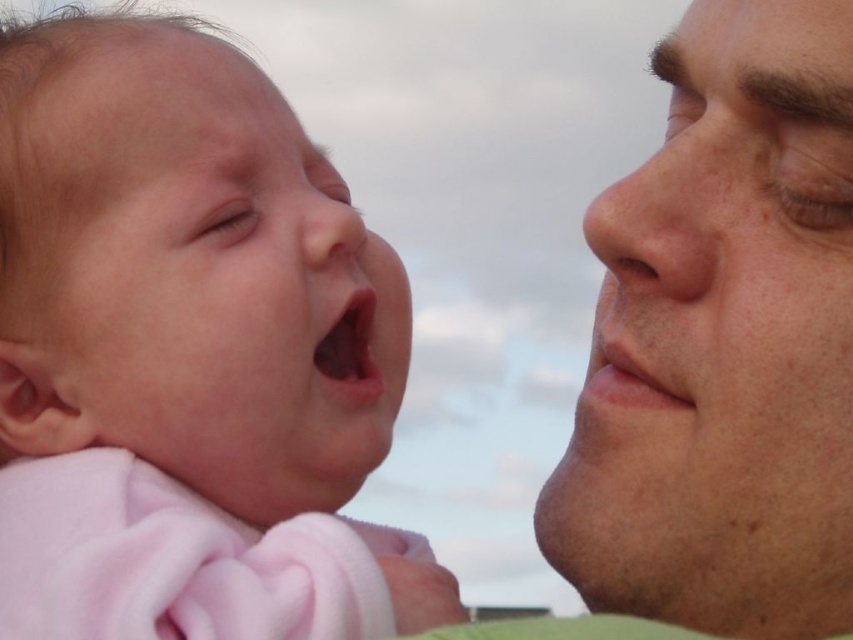
Question: Which point is closer to the camera?

Choices:
 (A) smooth flesh nose at center
 (B) pink soft fabric baby at left
 (C) smooth skin face at right

Answer: (C)

Question: Which of the following is the farthest from the observer?

Choices:
 (A) (706, 291)
 (B) (287, 541)

Answer: (B)

Question: Can you confirm if pink soft fabric baby at left is positioned to the right of smooth skin face at right?

Choices:
 (A) no
 (B) yes

Answer: (A)

Question: Which object appears farthest from the camera in this image?

Choices:
 (A) smooth flesh nose at center
 (B) smooth skin face at right

Answer: (A)

Question: From the image, what is the correct spatial relationship of pink soft fabric baby at left in relation to smooth skin nose at right?

Choices:
 (A) above
 (B) below

Answer: (B)

Question: Does pink soft fabric baby at left have a greater width compared to smooth skin face at right?

Choices:
 (A) yes
 (B) no

Answer: (A)